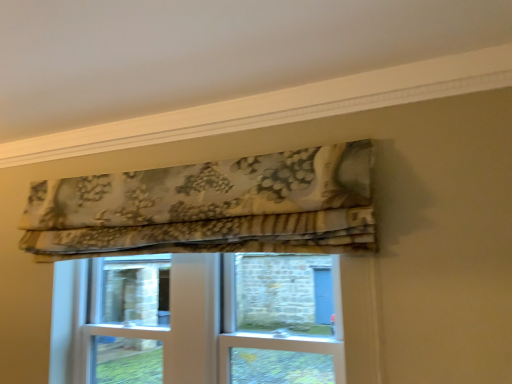
This screenshot has height=384, width=512. I want to click on clear glass screen door at center, so click(x=162, y=320).

This screenshot has width=512, height=384. What do you see at coordinates (162, 320) in the screenshot?
I see `clear glass screen door at center` at bounding box center [162, 320].

At what (x,y) coordinates should I click in order to perform the action: click on clear glass screen door at center. Please return your answer as a coordinate pair (x, y). The width and height of the screenshot is (512, 384). Looking at the image, I should click on (162, 320).